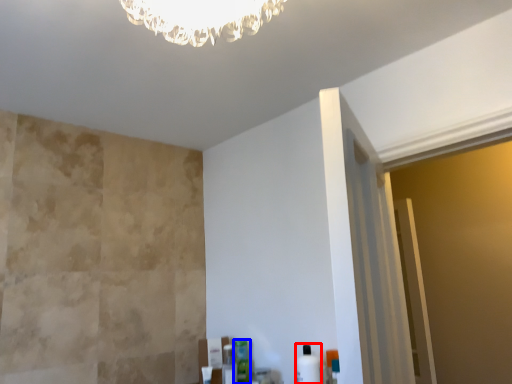
Question: Which object is further to the camera taking this photo, toiletry (highlighted by a red box) or toiletry (highlighted by a blue box)?

Choices:
 (A) toiletry
 (B) toiletry

Answer: (B)